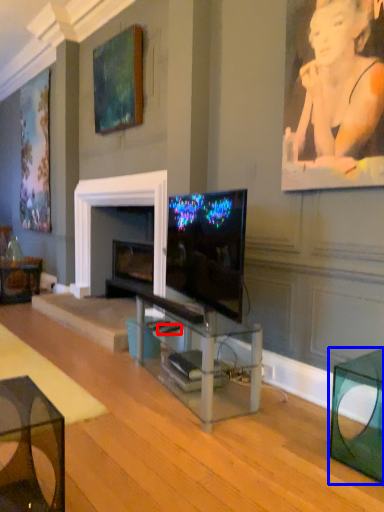
Question: Which of the following is the closest to the observer, remote control (highlighted by a red box) or table (highlighted by a blue box)?

Choices:
 (A) remote control
 (B) table

Answer: (B)